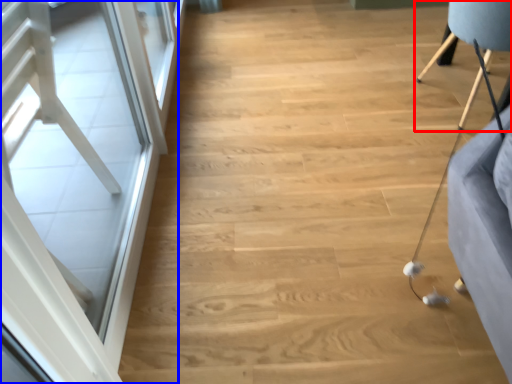
Question: Which object appears closest to the camera in this image, furniture (highlighted by a red box) or screen door (highlighted by a blue box)?

Choices:
 (A) furniture
 (B) screen door

Answer: (B)